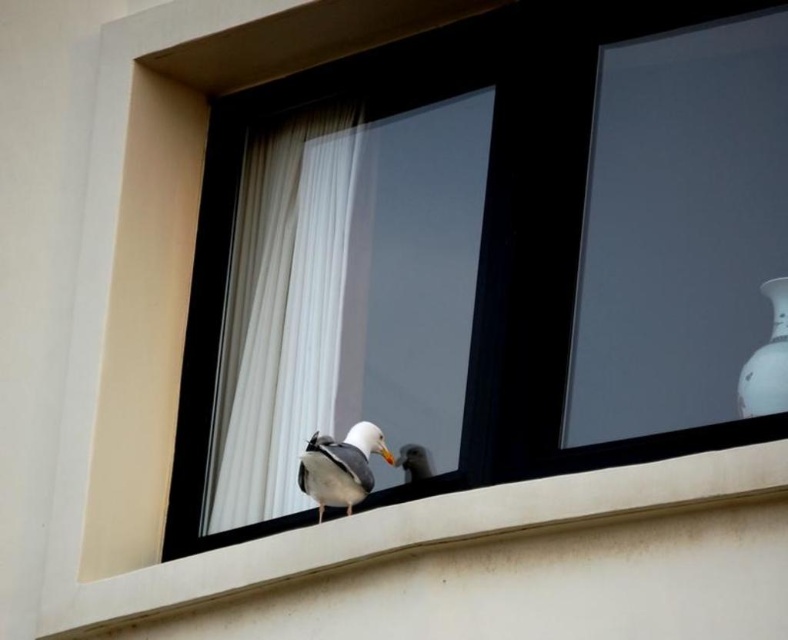
Question: Which point is farther from the camera taking this photo?

Choices:
 (A) (614, 189)
 (B) (147, 600)
 (C) (414, 448)

Answer: (C)

Question: Does matte glass window at center appear under white smooth concrete at center?

Choices:
 (A) yes
 (B) no

Answer: (B)

Question: Which of the following is the closest to the observer?

Choices:
 (A) white matte bird at center
 (B) white sheer curtain at center
 (C) white porcelain vase at upper right

Answer: (C)

Question: Does matte glass window at center have a larger size compared to white matte bird at center?

Choices:
 (A) no
 (B) yes

Answer: (B)

Question: Is the position of white smooth concrete at center more distant than that of white feathered bird at center?

Choices:
 (A) no
 (B) yes

Answer: (A)

Question: Based on their relative distances, which object is farther from the white porcelain vase at upper right?

Choices:
 (A) white matte bird at center
 (B) white sheer curtain at center

Answer: (B)